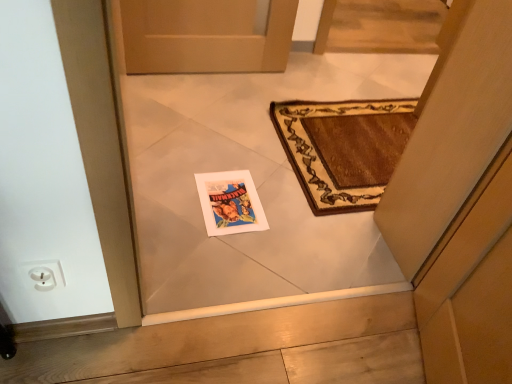
Image resolution: width=512 pixels, height=384 pixels. Identify the location of free location above matte paper comic book at center (from a real-world perspective). (229, 195).